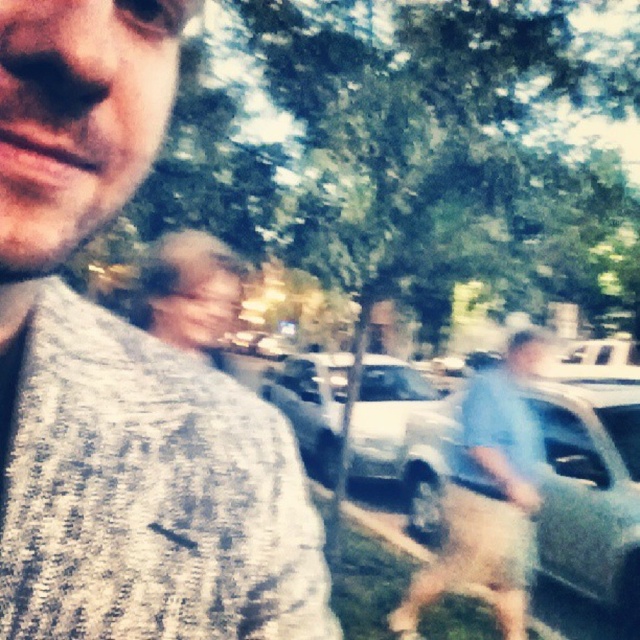
You are a photographer trying to capture a clear shot of the metallic silver car at center and the blue fabric shirt at center in the image. Which object is closer to the camera lens?

The metallic silver car at center is closer to the camera lens than the blue fabric shirt at center because it is further to the viewer.

You are looking at a selfie taken outdoors. You notice two clothing items on the person in the photo. The gray knitted sweater at left and the blue fabric shirt at center. Which clothing item is located more to the left?

The gray knitted sweater at left is positioned on the left side of blue fabric shirt at center, so the gray knitted sweater at left is more to the left.

You are a drone operator trying to capture a photo of the two points in the image. The first point is labeled as point (38, 108) and the second is point (428, 435). Since you want to ensure both points are clearly visible in the photo, which point should you focus on first to avoid blurring the other?

Point (38, 108) is in front of point (428, 435). Therefore, you should focus on point (38, 108) first to ensure it is in clear focus before adjusting for the background point (428, 435).